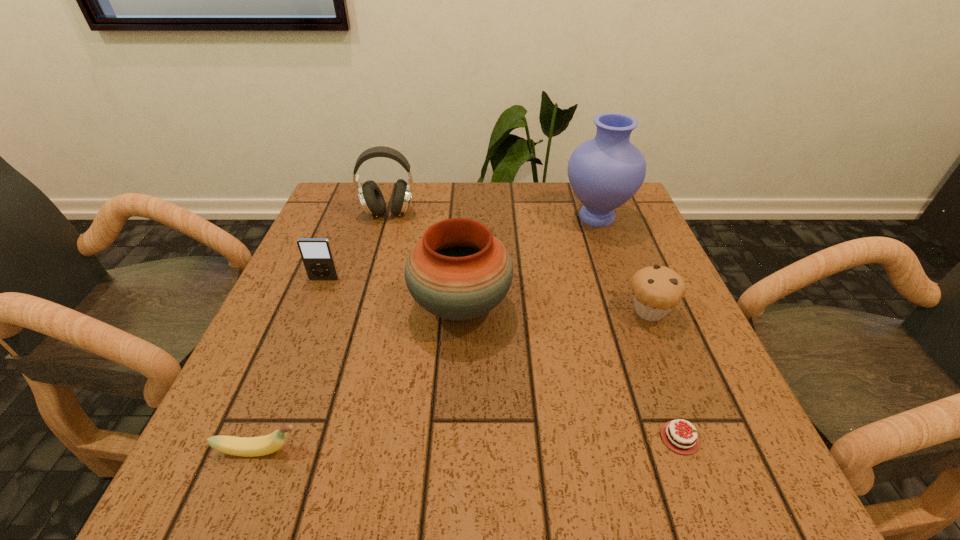
Where is `vacant region at the left edge`? vacant region at the left edge is located at coordinates (359, 235).

Find the location of a particular element. The height and width of the screenshot is (540, 960). free region at the right edge of the desktop is located at coordinates (594, 253).

Where is `vacant space at the far left corner of the desktop`? The image size is (960, 540). vacant space at the far left corner of the desktop is located at coordinates (337, 200).

Locate an element on the screen. Image resolution: width=960 pixels, height=540 pixels. free space at the near left corner of the desktop is located at coordinates (210, 483).

Identify the location of empty space between the second shortest object and the shortest object. This screenshot has width=960, height=540. (469, 444).

The image size is (960, 540). What are the coordinates of `free spot between the fourth object from right to left and the banana` in the screenshot? It's located at (360, 378).

The image size is (960, 540). What are the coordinates of `vacant point located between the headset and the shortest object` in the screenshot? It's located at (534, 326).

You are a GUI agent. You are given a task and a screenshot of the screen. Output one action in this format:
    pyautogui.click(x=<x>, y=<y>)
    Task: Click on the free space that is in between the pottery and the iPod
    The width and height of the screenshot is (960, 540).
    Given the screenshot: What is the action you would take?
    pyautogui.click(x=393, y=292)

This screenshot has width=960, height=540. I want to click on vacant space that's between the muffin and the headset, so click(x=519, y=262).

Identify the location of empty location between the headset and the tallest object. (492, 215).